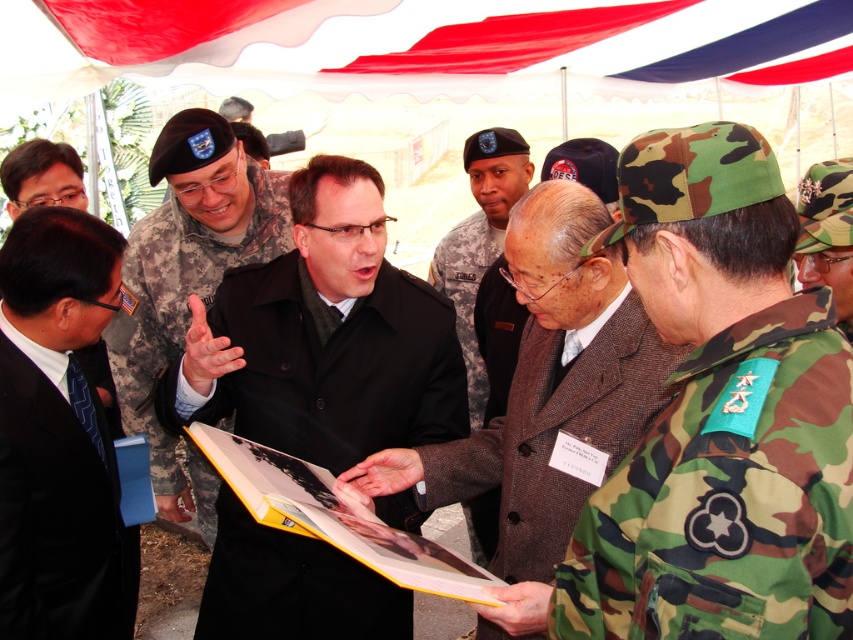
Question: Does brown woolen coat at center appear on the right side of camouflage uniform at center?

Choices:
 (A) yes
 (B) no

Answer: (A)

Question: Which object is the farthest from the camouflage uniform at center?

Choices:
 (A) black suit at left
 (B) camo fabric hat at right

Answer: (B)

Question: Which object is the closest to the camouflage uniform at center?

Choices:
 (A) black suit at upper left
 (B) camo fabric hat at right
 (C) brown woolen coat at center

Answer: (A)

Question: Can you confirm if camouflage uniform at center is positioned to the left of brown wool coat at center?

Choices:
 (A) no
 (B) yes

Answer: (B)

Question: Among these points, which one is nearest to the camera?

Choices:
 (A) click(x=68, y=627)
 (B) click(x=521, y=468)
 (C) click(x=712, y=408)

Answer: (C)

Question: Considering the relative positions of camo fabric uniform at center and brown wool coat at center in the image provided, where is camo fabric uniform at center located with respect to brown wool coat at center?

Choices:
 (A) left
 (B) right

Answer: (B)